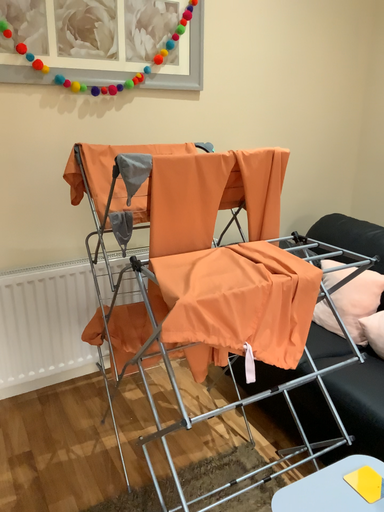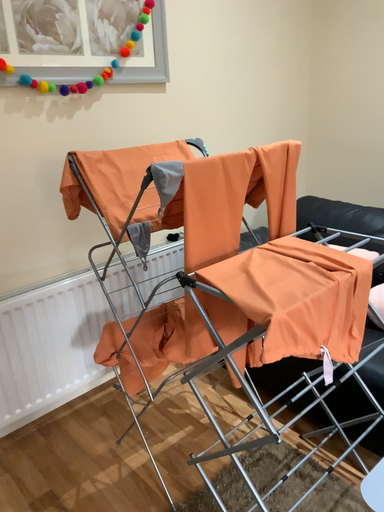
Question: How did the camera likely rotate when shooting the video?

Choices:
 (A) rotated left
 (B) rotated right

Answer: (B)